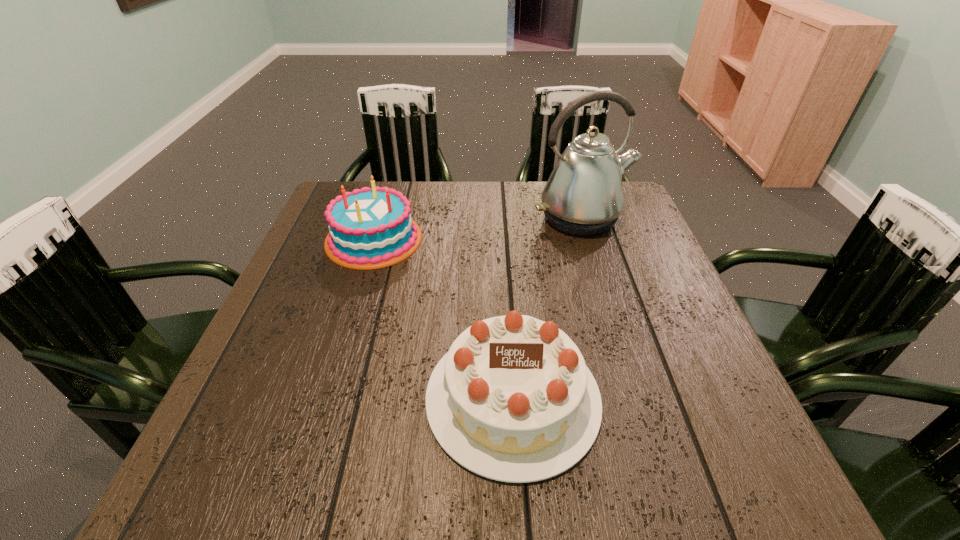
You are a GUI agent. You are given a task and a screenshot of the screen. Output one action in this format:
    pyautogui.click(x=<x>, y=<y>)
    Task: Click on the free space between the tallest object and the right birthday cake
    Image resolution: width=960 pixels, height=540 pixels.
    Given the screenshot: What is the action you would take?
    pyautogui.click(x=547, y=308)

Image resolution: width=960 pixels, height=540 pixels. I want to click on free space between the left birthday cake and the right birthday cake, so click(444, 319).

In order to click on vacant space that is in between the nearer birthday cake and the farther birthday cake in this screenshot , I will do `click(444, 319)`.

The height and width of the screenshot is (540, 960). Find the location of `vacant space in between the right birthday cake and the kettle`. vacant space in between the right birthday cake and the kettle is located at coordinates [x=547, y=308].

Find the location of a particular element. Image resolution: width=960 pixels, height=540 pixels. vacant region between the kettle and the left birthday cake is located at coordinates (478, 229).

At what (x,y) coordinates should I click in order to perform the action: click on free spot between the kettle and the leftmost object. Please return your answer as a coordinate pair (x, y). This screenshot has height=540, width=960. Looking at the image, I should click on (478, 229).

Where is `vacant area that lies between the leftmost object and the nearer birthday cake`? This screenshot has width=960, height=540. vacant area that lies between the leftmost object and the nearer birthday cake is located at coordinates (444, 319).

The width and height of the screenshot is (960, 540). In order to click on empty location between the nearer birthday cake and the left birthday cake in this screenshot , I will do point(444,319).

Find the location of `blank region between the left birthday cake and the right birthday cake`. blank region between the left birthday cake and the right birthday cake is located at coordinates (444, 319).

Where is `free space between the left birthday cake and the nearer birthday cake`? free space between the left birthday cake and the nearer birthday cake is located at coordinates (444, 319).